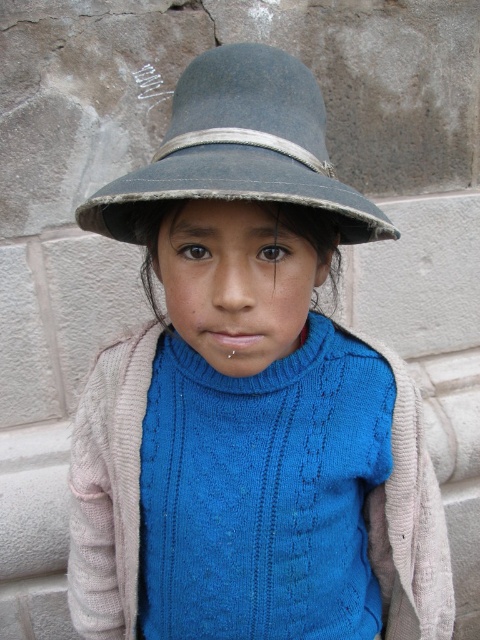
Question: Among these objects, which one is nearest to the camera?

Choices:
 (A) worn blue fabric hat at upper center
 (B) blue knitted sweater at center

Answer: (A)

Question: Which of the following is the farthest from the observer?

Choices:
 (A) (117, 205)
 (B) (264, 236)

Answer: (A)

Question: Where is worn blue fabric hat at upper center located in relation to blue knitted sweater at center in the image?

Choices:
 (A) above
 (B) below

Answer: (A)

Question: Can you confirm if worn blue fabric hat at upper center is positioned above blue knitted sweater at center?

Choices:
 (A) yes
 (B) no

Answer: (A)

Question: From the image, what is the correct spatial relationship of worn blue fabric hat at upper center in relation to blue knitted sweater at center?

Choices:
 (A) left
 (B) right

Answer: (B)

Question: Which object is farther from the camera taking this photo?

Choices:
 (A) worn blue fabric hat at upper center
 (B) blue knitted sweater at center

Answer: (B)